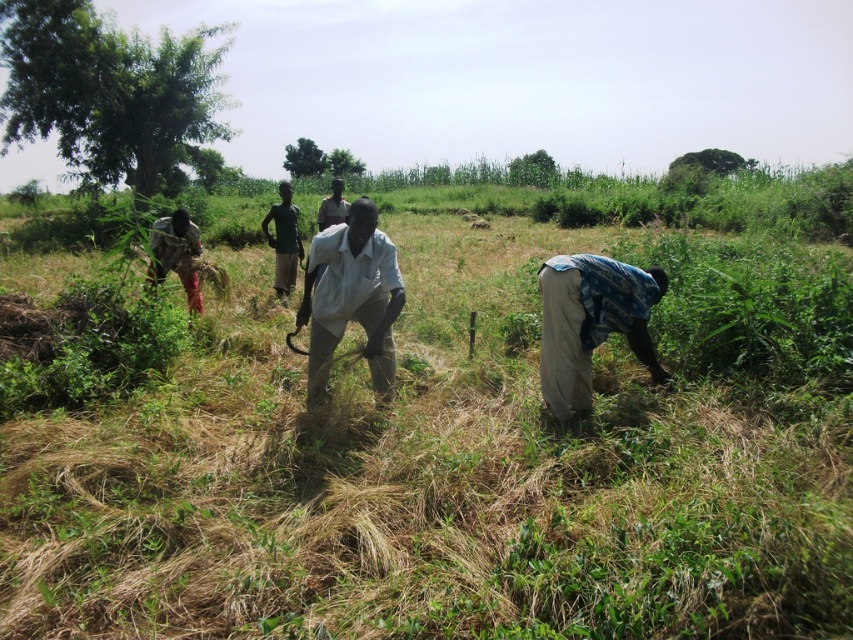
Question: Does dry grass at center appear over white cotton shirt at center?

Choices:
 (A) yes
 (B) no

Answer: (A)

Question: Does blue-patterned fabric at lower right have a lesser width compared to light gray shirt at center?

Choices:
 (A) no
 (B) yes

Answer: (B)

Question: Can you confirm if white cotton shirt at center is positioned to the right of camouflage fabric shirt at left?

Choices:
 (A) yes
 (B) no

Answer: (A)

Question: Estimate the real-world distances between objects in this image. Which object is farther from the blue-patterned fabric at lower right?

Choices:
 (A) white cotton shirt at center
 (B) dark green shirt at center
 (C) dry grass at center

Answer: (B)

Question: Estimate the real-world distances between objects in this image. Which object is farther from the dark green shirt at center?

Choices:
 (A) camouflage fabric shirt at left
 (B) white cotton shirt at center
 (C) light gray shirt at center
 (D) blue-patterned fabric at lower right

Answer: (D)

Question: Among these points, which one is nearest to the camera?

Choices:
 (A) (300, 256)
 (B) (339, 332)
 (C) (132, 518)
 (D) (334, 195)

Answer: (C)